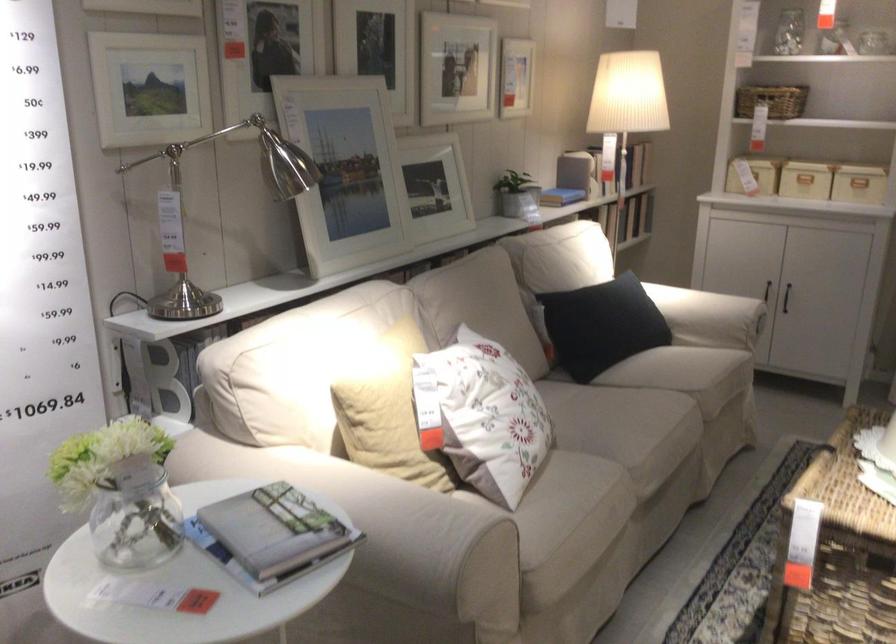
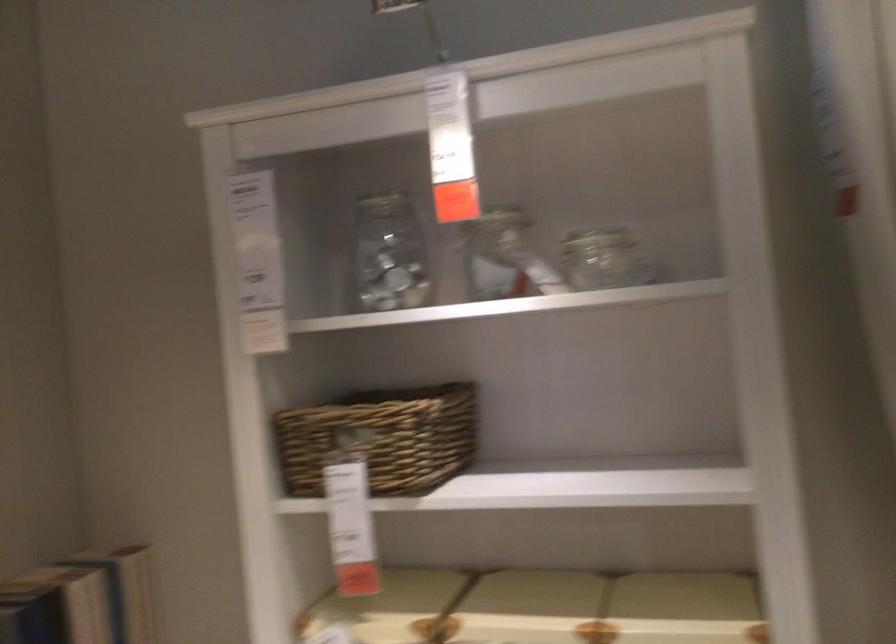
The images are taken continuously from a first-person perspective. In which direction are you moving?

The cameraman walked toward right, forward.